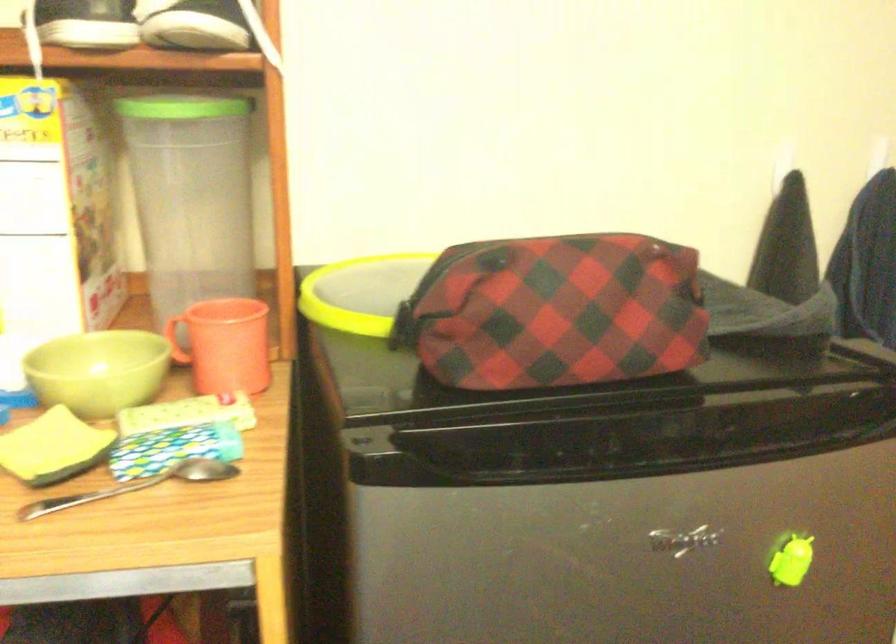
Which object does [135,486] point to?

It corresponds to the metal spoon in the image.